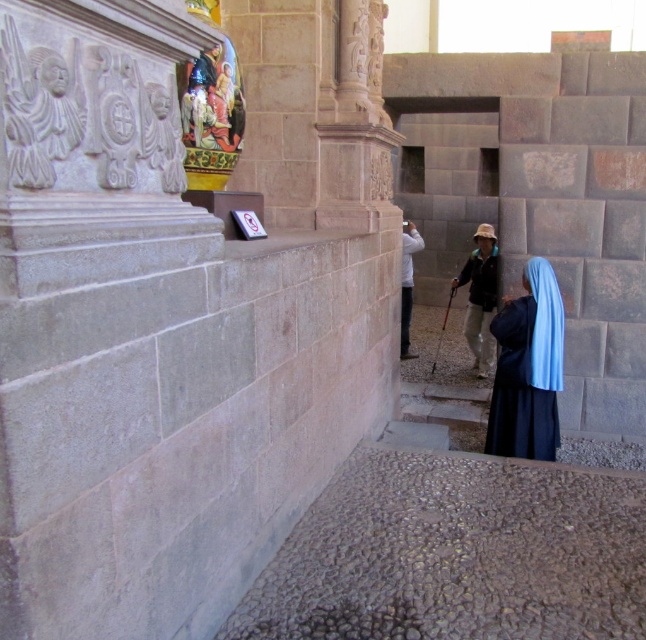
Question: Which of the following is the farthest from the observer?

Choices:
 (A) (408, 285)
 (B) (556, 410)
 (C) (494, 289)

Answer: (A)

Question: Which object appears farthest from the camera in this image?

Choices:
 (A) shiny gold vase at upper center
 (B) black matte robe at center
 (C) white matte jacket at center
 (D) blue fabric headscarf at lower right

Answer: (C)

Question: Can you confirm if blue fabric headscarf at lower right is positioned to the left of black matte robe at center?

Choices:
 (A) yes
 (B) no

Answer: (A)

Question: Is shiny gold vase at upper center positioned behind white matte jacket at center?

Choices:
 (A) yes
 (B) no

Answer: (B)

Question: Estimate the real-world distances between objects in this image. Which object is closer to the blue fabric headscarf at lower right?

Choices:
 (A) black matte robe at center
 (B) shiny gold vase at upper center

Answer: (B)

Question: Does black matte robe at center appear on the right side of white matte jacket at center?

Choices:
 (A) yes
 (B) no

Answer: (A)